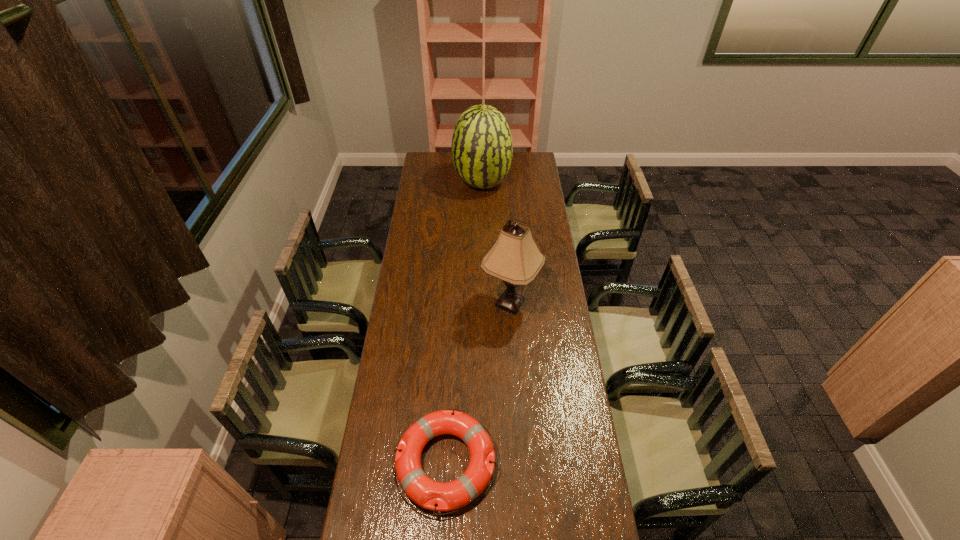
The image size is (960, 540). What are the coordinates of `watermelon` in the screenshot? It's located at (482, 149).

Find the location of a particular element. The width and height of the screenshot is (960, 540). lamp is located at coordinates (515, 259).

In order to click on the nearest object in this screenshot , I will do `click(425, 492)`.

Locate an element on the screen. The width and height of the screenshot is (960, 540). life buoy is located at coordinates (425, 492).

Identify the location of vacant region located on the left of the farthest object. (435, 184).

Identify the location of blank area located on the back of the lamp. (506, 239).

Where is `free space located on the right of the nearest object`? free space located on the right of the nearest object is located at coordinates (586, 463).

At what (x,y) coordinates should I click in order to perform the action: click on object that is at the far edge. Please return your answer as a coordinate pair (x, y). Looking at the image, I should click on tap(482, 149).

The image size is (960, 540). In order to click on object that is at the left edge in this screenshot , I will do `click(425, 492)`.

Locate an element on the screen. object that is at the right edge is located at coordinates (515, 259).